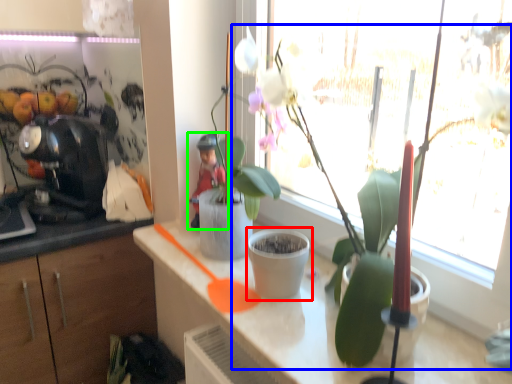
Question: Which object is the closest to the flowerpot (highlighted by a red box)? Choose among these: houseplant (highlighted by a blue box) or person (highlighted by a green box).

Choices:
 (A) houseplant
 (B) person

Answer: (A)